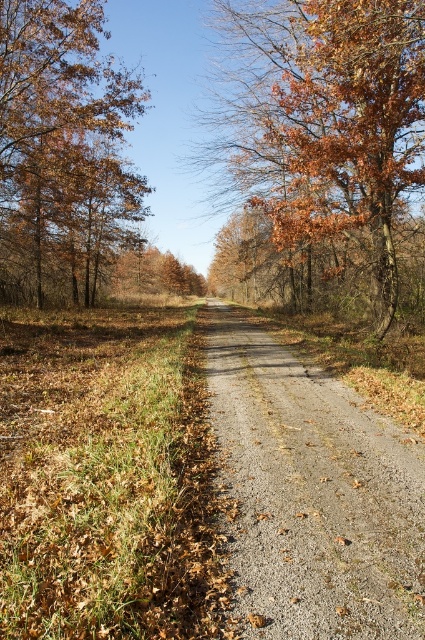
Question: Is the position of gray gravel road at center less distant than that of brown textured leaves at center?

Choices:
 (A) no
 (B) yes

Answer: (B)

Question: Which object is farther from the camera taking this photo?

Choices:
 (A) brown matte tree at upper left
 (B) brown textured leaves at center

Answer: (A)

Question: Does gray gravel road at center appear on the left side of brown matte tree at upper left?

Choices:
 (A) no
 (B) yes

Answer: (A)

Question: Which point is closer to the camera?

Choices:
 (A) (25, 285)
 (B) (291, 384)
 (C) (382, 132)

Answer: (B)

Question: Is gray gravel road at center thinner than brown matte tree at upper left?

Choices:
 (A) yes
 (B) no

Answer: (A)

Question: Among these objects, which one is farthest from the camera?

Choices:
 (A) brown matte tree at upper left
 (B) brown textured leaves at center

Answer: (A)